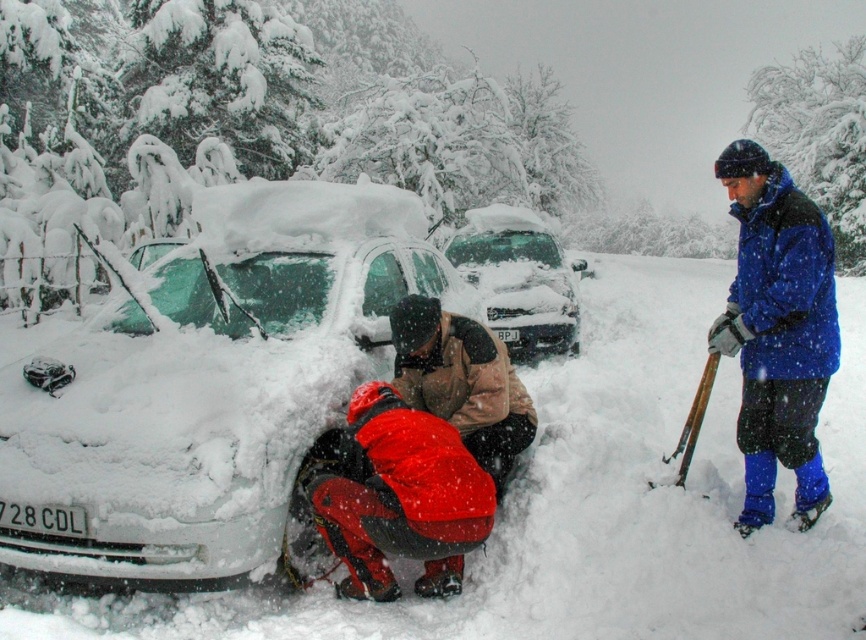
Question: Which point appears closest to the camera in this image?

Choices:
 (A) (481, 472)
 (B) (528, 269)
 (C) (509, 397)

Answer: (A)

Question: From the image, what is the correct spatial relationship of white fluffy snow at lower left in relation to snow-covered car at center?

Choices:
 (A) left
 (B) right

Answer: (B)

Question: Is white fluffy snow at lower left to the right of snow-covered car at center from the viewer's perspective?

Choices:
 (A) no
 (B) yes

Answer: (B)

Question: Considering the real-world distances, which object is farthest from the white fluffy snow at lower left?

Choices:
 (A) red fabric jacket at lower center
 (B) green metallic shovel at right
 (C) red fabric pants at lower center

Answer: (B)

Question: Which point is closer to the camera?

Choices:
 (A) green metallic shovel at right
 (B) white matte car at center
 (C) red fabric pants at lower center

Answer: (B)

Question: Can you confirm if white matte car at center is positioned to the right of red fabric jacket at lower center?

Choices:
 (A) yes
 (B) no

Answer: (B)